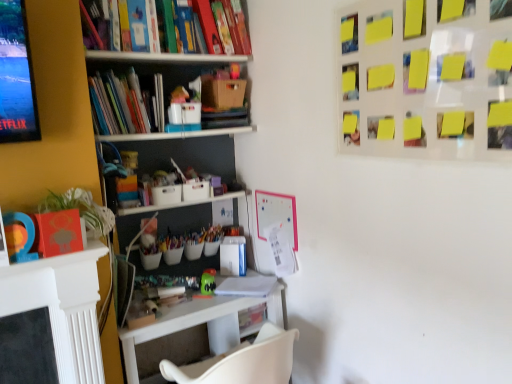
Question: Could you tell me if hardcover books at left is turned towards brown cardboard box at upper center?

Choices:
 (A) yes
 (B) no

Answer: (B)

Question: From a real-world perspective, does hardcover books at left sit lower than brown cardboard box at upper center?

Choices:
 (A) yes
 (B) no

Answer: (A)

Question: Is hardcover books at left located outside brown cardboard box at upper center?

Choices:
 (A) no
 (B) yes

Answer: (B)

Question: Is brown cardboard box at upper center surrounded by hardcover books at left?

Choices:
 (A) no
 (B) yes

Answer: (A)

Question: Considering the relative sizes of hardcover books at left and brown cardboard box at upper center in the image provided, is hardcover books at left thinner than brown cardboard box at upper center?

Choices:
 (A) yes
 (B) no

Answer: (B)

Question: From a real-world perspective, is hardcover books at left above or below brown cardboard box at upper center?

Choices:
 (A) below
 (B) above

Answer: (A)

Question: Considering the positions of hardcover books at left and brown cardboard box at upper center in the image, is hardcover books at left bigger or smaller than brown cardboard box at upper center?

Choices:
 (A) big
 (B) small

Answer: (A)

Question: From their relative heights in the image, would you say hardcover books at left is taller or shorter than brown cardboard box at upper center?

Choices:
 (A) tall
 (B) short

Answer: (A)

Question: Is hardcover books at left wider or thinner than brown cardboard box at upper center?

Choices:
 (A) thin
 (B) wide

Answer: (B)

Question: In terms of height, does green leafy plant at left look taller or shorter compared to green matte toy at center?

Choices:
 (A) tall
 (B) short

Answer: (A)

Question: From a real-world perspective, is green leafy plant at left physically located above or below green matte toy at center?

Choices:
 (A) above
 (B) below

Answer: (A)

Question: Is green leafy plant at left in front of or behind green matte toy at center in the image?

Choices:
 (A) behind
 (B) front

Answer: (B)

Question: From the image's perspective, is green leafy plant at left located above or below green matte toy at center?

Choices:
 (A) above
 (B) below

Answer: (A)

Question: From a real-world perspective, is green leafy plant at left physically located above or below brown cardboard box at upper center?

Choices:
 (A) above
 (B) below

Answer: (B)

Question: From the image's perspective, is green leafy plant at left above or below brown cardboard box at upper center?

Choices:
 (A) below
 (B) above

Answer: (A)